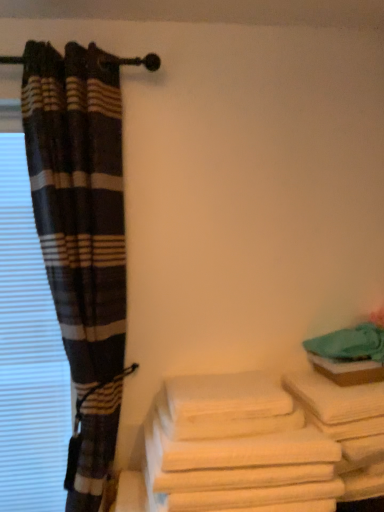
Question: Is white cotton towels at lower right to the right of white blinds at left from the viewer's perspective?

Choices:
 (A) yes
 (B) no

Answer: (A)

Question: Is white cotton towels at lower right facing towards white blinds at left?

Choices:
 (A) no
 (B) yes

Answer: (A)

Question: Is white cotton towels at lower right further to camera compared to white blinds at left?

Choices:
 (A) yes
 (B) no

Answer: (B)

Question: From the image's perspective, is white cotton towels at lower right on white blinds at left?

Choices:
 (A) no
 (B) yes

Answer: (A)

Question: Can you confirm if white cotton towels at lower right is positioned to the left of white blinds at left?

Choices:
 (A) yes
 (B) no

Answer: (B)

Question: Is plaid fabric curtain at left situated inside white cotton towels at lower right or outside?

Choices:
 (A) inside
 (B) outside

Answer: (B)

Question: From a real-world perspective, is plaid fabric curtain at left physically located above or below white cotton towels at lower right?

Choices:
 (A) above
 (B) below

Answer: (A)

Question: Would you say plaid fabric curtain at left is to the left or to the right of white cotton towels at lower right in the picture?

Choices:
 (A) right
 (B) left

Answer: (B)

Question: Considering the positions of plaid fabric curtain at left and white cotton towels at lower right in the image, is plaid fabric curtain at left bigger or smaller than white cotton towels at lower right?

Choices:
 (A) small
 (B) big

Answer: (B)

Question: Is white cotton towels at lower right situated inside white blinds at left or outside?

Choices:
 (A) inside
 (B) outside

Answer: (B)

Question: From a real-world perspective, is white cotton towels at lower right above or below white blinds at left?

Choices:
 (A) above
 (B) below

Answer: (B)

Question: Is point (294, 456) positioned closer to the camera than point (14, 151)?

Choices:
 (A) closer
 (B) farther

Answer: (A)

Question: From the image's perspective, is white cotton towels at lower right located above or below white blinds at left?

Choices:
 (A) below
 (B) above

Answer: (A)

Question: Is white blinds at left bigger or smaller than white cotton towels at lower right?

Choices:
 (A) small
 (B) big

Answer: (A)

Question: Is white blinds at left spatially inside white cotton towels at lower right, or outside of it?

Choices:
 (A) outside
 (B) inside

Answer: (A)